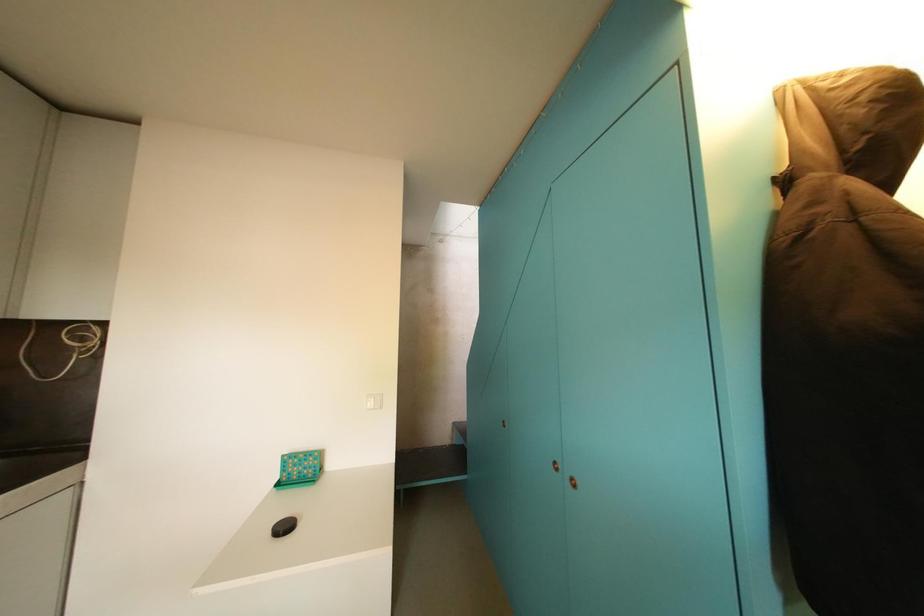
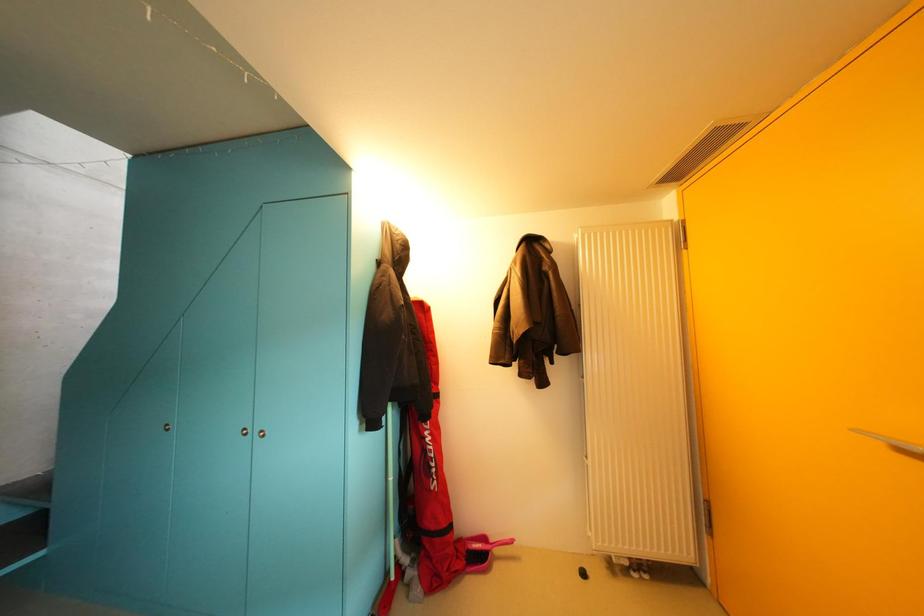
Question: The camera is either moving clockwise (left) or counter-clockwise (right) around the object. The first image is from the beginning of the video and the second image is from the end. Is the camera moving left or right when shooting the video?

Choices:
 (A) Left
 (B) Right

Answer: (A)